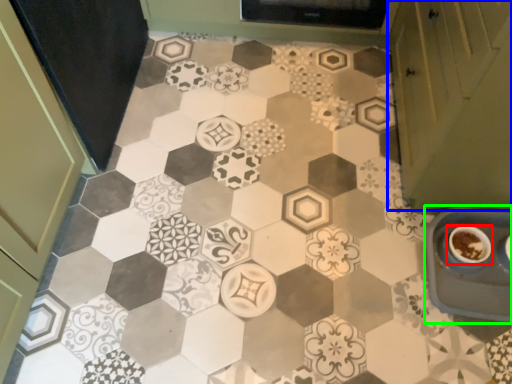
Question: Based on their relative distances, which object is farther from coffee cup (highlighted by a red box)? Choose from cabinetry (highlighted by a blue box) and sink (highlighted by a green box).

Choices:
 (A) cabinetry
 (B) sink

Answer: (A)